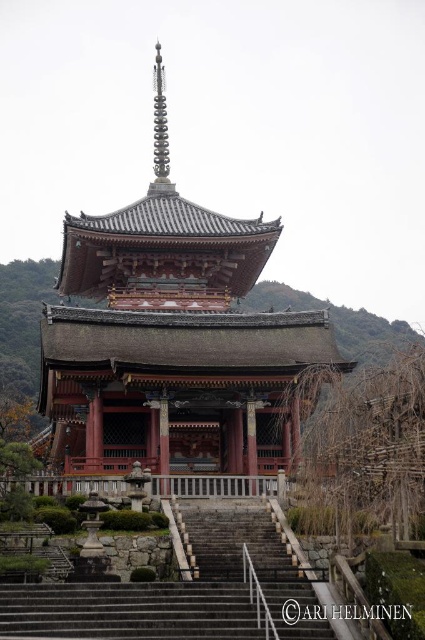
You are a visitor at the temple and want to take a photo of the shiny red pagoda at center. You are standing on the dark gray stone stairs at center. Which direction should you move to get a better view of the pagoda?

Since the shiny red pagoda at center might be wider than dark gray stone stairs at center, you should move upwards along the dark gray stone stairs at center to get a better view of the pagoda.

From the picture: You are standing at the base of the temple steps and want to climb up to the entrance. Which set of stairs should you take first, the dark gray stone stairs at center or the gray stone stairs at lower center?

You should take the gray stone stairs at lower center first because the dark gray stone stairs at center are positioned under them, meaning the gray stone stairs at lower center are the lower level leading up to the upper ones.